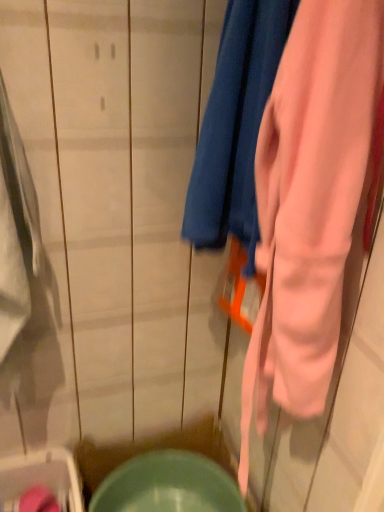
Question: From the image's perspective, relative to matte green bowl at lower center, is pink soft fabric towel at center above or below?

Choices:
 (A) above
 (B) below

Answer: (A)

Question: Looking at the image, does pink soft fabric towel at center seem bigger or smaller compared to matte green bowl at lower center?

Choices:
 (A) small
 (B) big

Answer: (B)

Question: Which object is the farthest from the pink soft fabric towel at center?

Choices:
 (A) matte green bowl at lower center
 (B) matte green plastic washer at lower left

Answer: (B)

Question: Which is farther from the matte green plastic washer at lower left?

Choices:
 (A) pink soft fabric towel at center
 (B) matte green bowl at lower center

Answer: (A)